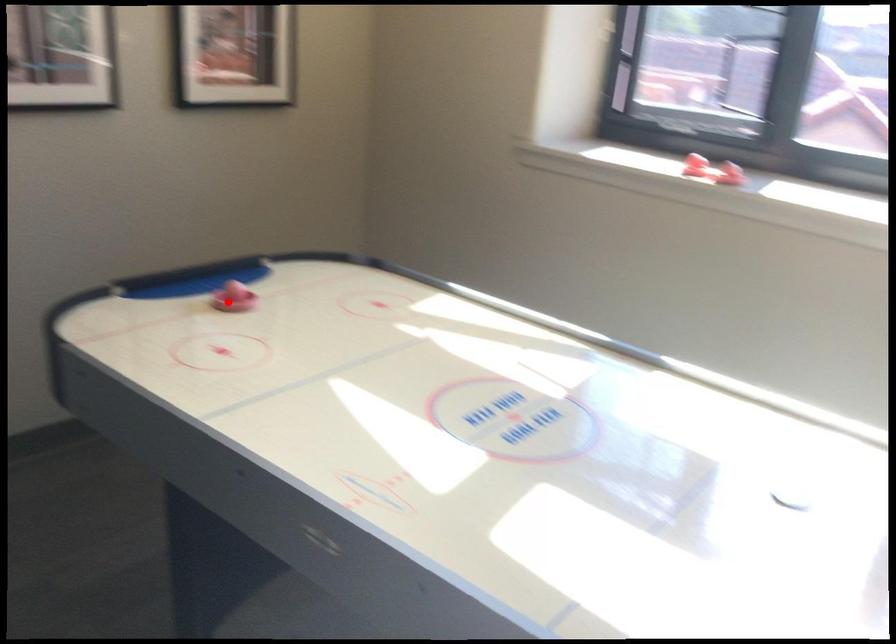
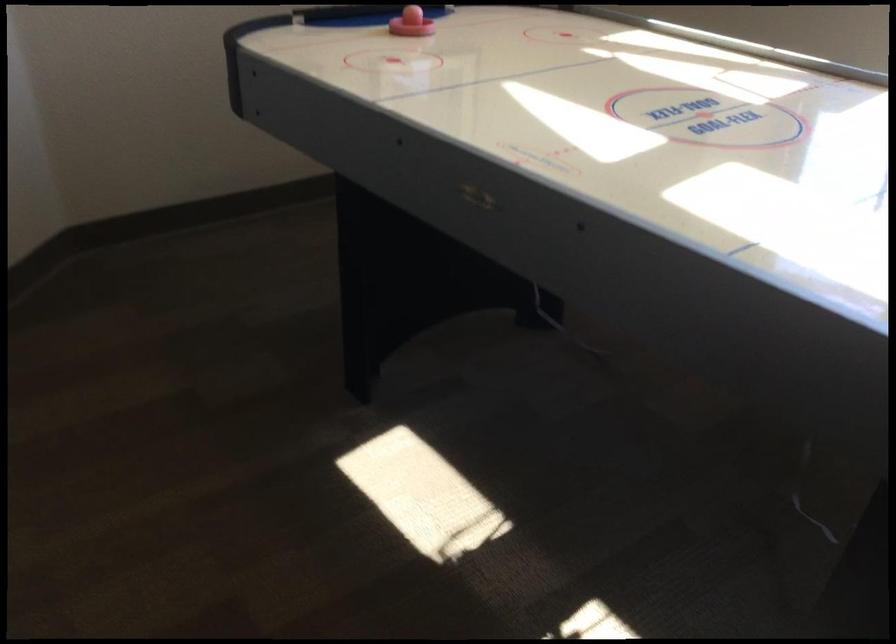
The point at the highlighted location is marked in the first image. Where is the corresponding point in the second image?

(410, 23)